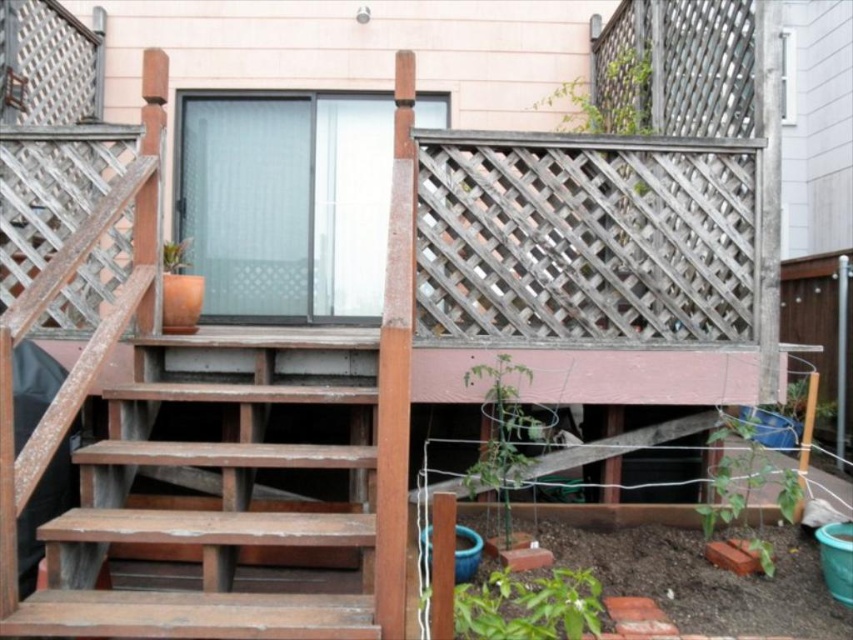
Question: Is green leafy plant at lower right above green leafy plant at upper center?

Choices:
 (A) no
 (B) yes

Answer: (A)

Question: Does weathered wood stairs at lower left appear under matte brown pot at upper left?

Choices:
 (A) no
 (B) yes

Answer: (B)

Question: Which point is closer to the camera?

Choices:
 (A) (741, 477)
 (B) (498, 608)
 (C) (293, 540)

Answer: (C)

Question: Does green leafy plant at lower center have a lesser width compared to green leafy plant at lower right?

Choices:
 (A) no
 (B) yes

Answer: (B)

Question: Which point is farther to the camera?

Choices:
 (A) weathered wood stairs at lower left
 (B) green leafy plant at lower right

Answer: (B)

Question: Which object is farther from the camera taking this photo?

Choices:
 (A) green leafy plant at lower center
 (B) clear frosted glass screen door at center

Answer: (B)